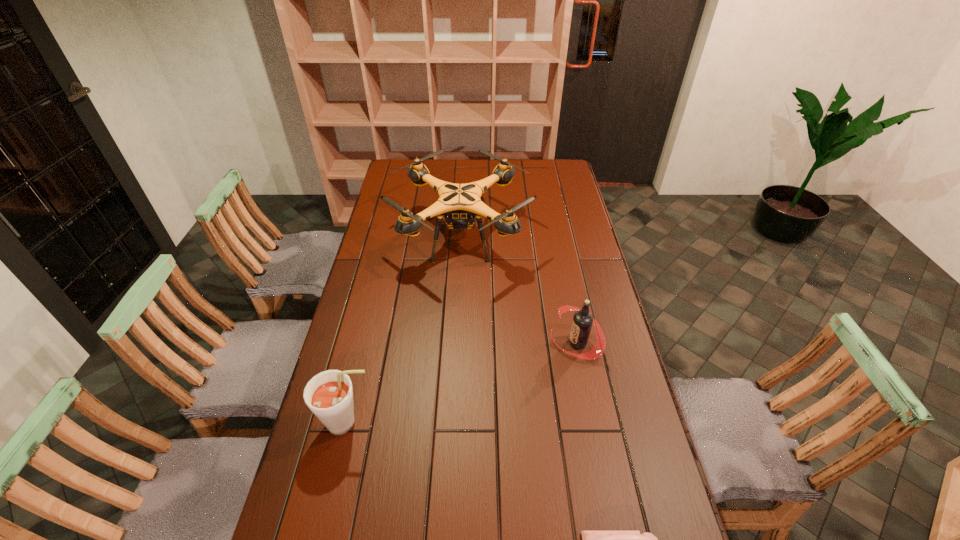
In order to click on the farthest object in this screenshot , I will do `click(462, 205)`.

Identify the location of the tallest object. The width and height of the screenshot is (960, 540). (462, 205).

Locate an element on the screen. The image size is (960, 540). the nearer root beer is located at coordinates (329, 395).

Find the location of `the second nearest object`. the second nearest object is located at coordinates (329, 395).

Where is `the farther root beer`? The width and height of the screenshot is (960, 540). the farther root beer is located at coordinates (582, 322).

Where is `the third nearest object`? the third nearest object is located at coordinates (582, 322).

Locate an element on the screen. The height and width of the screenshot is (540, 960). free spot located 0.240m on the camera mount of the drone is located at coordinates (587, 237).

You are a GUI agent. You are given a task and a screenshot of the screen. Output one action in this format:
    pyautogui.click(x=<x>, y=<y>)
    Task: Click on the vacant space situated 0.270m on the drink side of the nearer root beer
    The height and width of the screenshot is (540, 960).
    Given the screenshot: What is the action you would take?
    pyautogui.click(x=472, y=423)

In order to click on vacant space located 0.340m on the label of the second farthest object in this screenshot , I will do `click(448, 342)`.

Where is `free space located 0.380m on the label of the second farthest object`? free space located 0.380m on the label of the second farthest object is located at coordinates (436, 342).